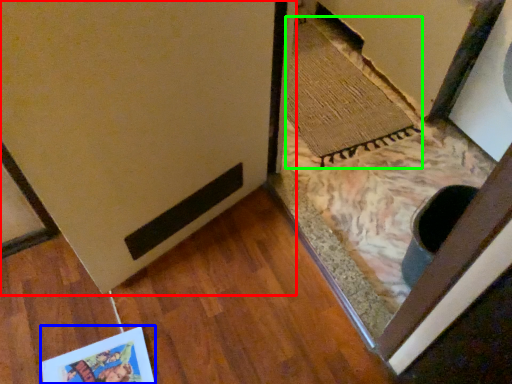
Question: Estimate the real-world distances between objects in this image. Which object is closer to door (highlighted by a red box), postcard (highlighted by a blue box) or doormat (highlighted by a green box)?

Choices:
 (A) postcard
 (B) doormat

Answer: (A)